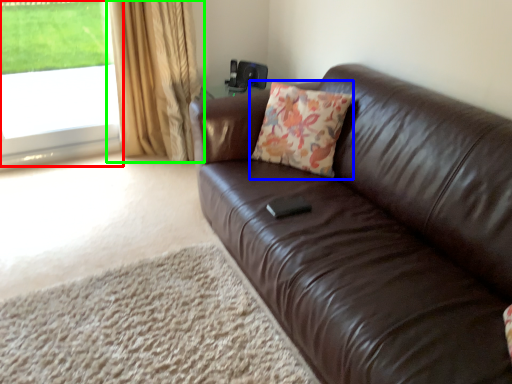
Question: Which object is positioned farthest from window (highlighted by a red box)? Select from throw pillow (highlighted by a blue box) and curtain (highlighted by a green box).

Choices:
 (A) throw pillow
 (B) curtain

Answer: (A)